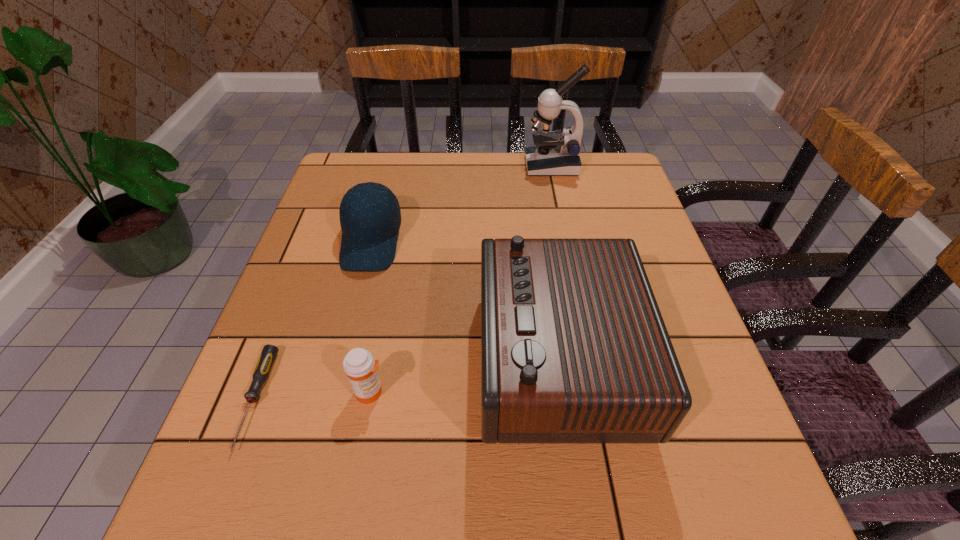
The width and height of the screenshot is (960, 540). What are the coordinates of `radio receiver that is at the right edge` in the screenshot? It's located at (574, 350).

You are a GUI agent. You are given a task and a screenshot of the screen. Output one action in this format:
    pyautogui.click(x=<x>, y=<y>)
    Task: Click on the object that is at the far right corner
    Image resolution: width=960 pixels, height=540 pixels.
    Given the screenshot: What is the action you would take?
    pyautogui.click(x=554, y=153)

Where is `vacant space at the far edge of the desktop`? The height and width of the screenshot is (540, 960). vacant space at the far edge of the desktop is located at coordinates (541, 184).

This screenshot has width=960, height=540. In order to click on vacant space at the near edge of the desktop in this screenshot , I will do `click(504, 471)`.

At what (x,y) coordinates should I click in order to perform the action: click on free space at the left edge of the desktop. Please return your answer as a coordinate pair (x, y). This screenshot has height=540, width=960. Looking at the image, I should click on (291, 446).

This screenshot has width=960, height=540. Identify the location of free point at the right edge. (708, 370).

Find the location of a particular element. The image size is (960, 540). free space at the far left corner of the desktop is located at coordinates (381, 161).

At what (x,y) coordinates should I click in order to perform the action: click on empty location between the radio receiver and the second farthest object. Please return your answer as a coordinate pair (x, y). The height and width of the screenshot is (540, 960). Looking at the image, I should click on click(x=465, y=300).

Locate an element on the screen. vacant area that lies between the fourth tallest object and the third tallest object is located at coordinates (371, 317).

Locate an element on the screen. free area in between the second farthest object and the medicine is located at coordinates (371, 317).